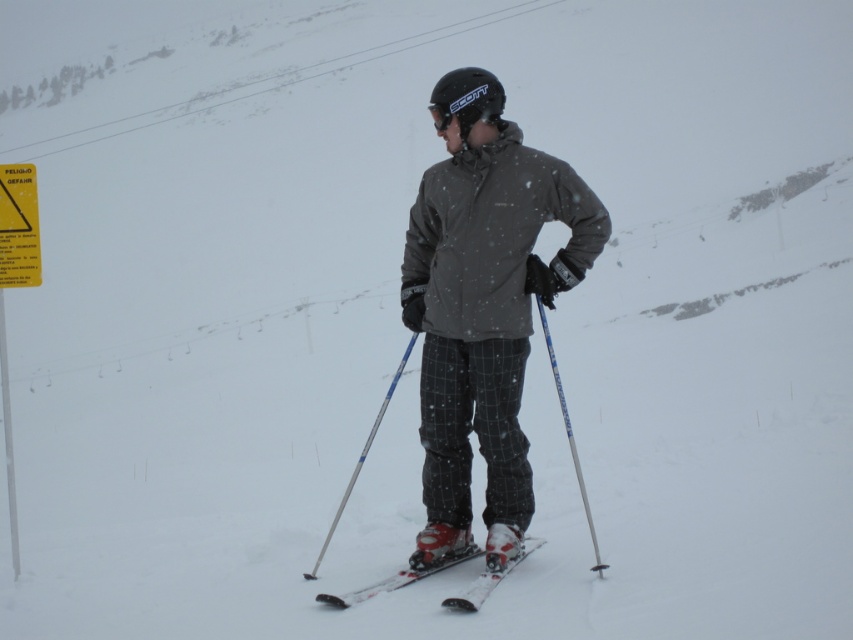
You are a photographer trying to capture the skier holding the silver metallic ski pole at center. You want to focus on the point at coordinate [363,456]. Is this point located on the skier or the ski pole?

The point at coordinate [363,456] is on the silver metallic ski pole at center, not the skier.

You are a skier standing at the point with coordinates [390,582]. You want to move towards the yellow warning sign mounted on a pole in the background. Which direction should you move relative to your current position?

The point [390,582] corresponds to the white plastic ski at center. Since the yellow warning sign is in the background, you should move forward from the white plastic ski at center to reach it.